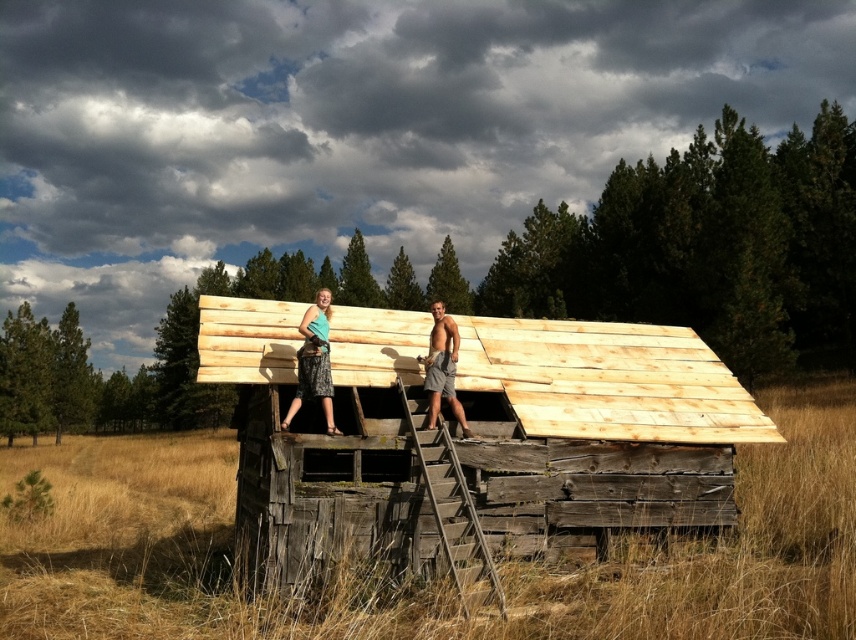
Is natural wood roof at upper center smaller than matte teal fabric skirt at center?

Indeed, natural wood roof at upper center has a smaller size compared to matte teal fabric skirt at center.

What are the coordinates of `natural wood roof at upper center` in the screenshot? It's located at (608, 381).

Is point (370, 326) in front of point (325, 342)?

No.

This screenshot has width=856, height=640. I want to click on natural wood roof at upper center, so click(608, 381).

Does natural wood roof at upper center have a larger size compared to wooden rough-textured ladder at center?

Yes.

Does natural wood roof at upper center lie behind wooden rough-textured ladder at center?

Yes, natural wood roof at upper center is behind wooden rough-textured ladder at center.

Is point (611, 388) farther from camera compared to point (467, 525)?

That is True.

Where is `natural wood roof at upper center`? This screenshot has width=856, height=640. natural wood roof at upper center is located at coordinates (608, 381).

Measure the distance between light brown wooden hut at center and tan textured shorts at center.

light brown wooden hut at center is 8.10 feet from tan textured shorts at center.

Is point (417, 372) less distant than point (438, 339)?

That is False.

You are a GUI agent. You are given a task and a screenshot of the screen. Output one action in this format:
    pyautogui.click(x=<x>, y=<y>)
    Task: Click on the light brown wooden hut at center
    Image resolution: width=856 pixels, height=640 pixels.
    Given the screenshot: What is the action you would take?
    pyautogui.click(x=473, y=440)